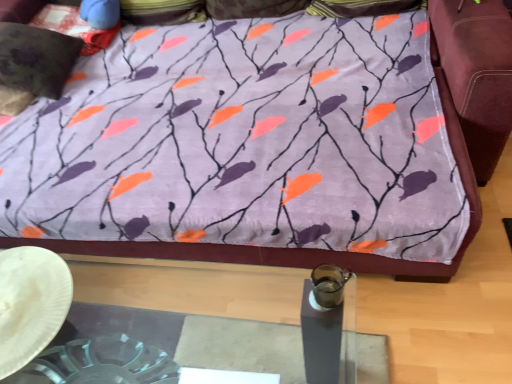
This screenshot has width=512, height=384. In order to click on vacant point above white paper plate at lower left (from a real-world perspective) in this screenshot , I will do `click(25, 293)`.